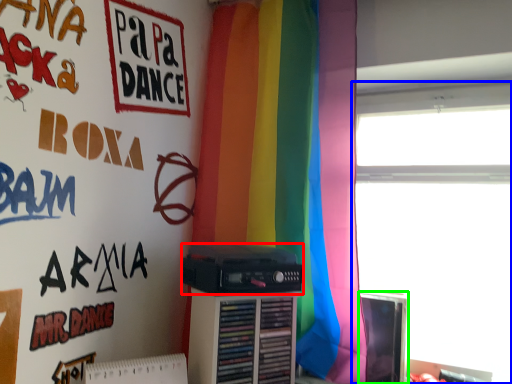
Question: Which object is positioned closest to cassette (highlighted by a red box)? Select from window (highlighted by a blue box) and computer monitor (highlighted by a green box).

Choices:
 (A) window
 (B) computer monitor

Answer: (B)